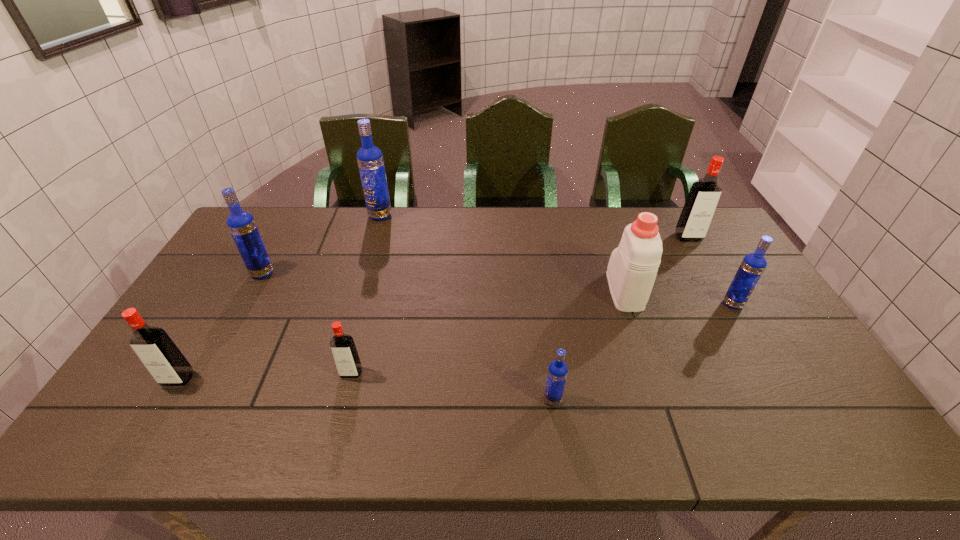
At what (x,y) coordinates should I click in order to perform the action: click on empty space that is in between the rightmost blue vodka and the tallest vodka. Please return your answer as a coordinate pair (x, y). Looking at the image, I should click on (557, 260).

Locate an element on the screen. This screenshot has height=540, width=960. vacant space that is in between the nearest vodka and the leftmost red vodka is located at coordinates [365, 389].

Locate an element on the screen. The width and height of the screenshot is (960, 540). empty space that is in between the sixth object from left to right and the fifth nearest vodka is located at coordinates (444, 282).

This screenshot has width=960, height=540. I want to click on free spot between the third farthest blue vodka and the tallest object, so click(557, 260).

Where is `free space between the sixth object from left to right and the second smallest red vodka`? free space between the sixth object from left to right and the second smallest red vodka is located at coordinates (401, 335).

Locate an element on the screen. The image size is (960, 540). empty location between the smallest red vodka and the farthest object is located at coordinates (366, 294).

Locate an element on the screen. vacant area that lies between the white detergent and the second smallest blue vodka is located at coordinates (679, 297).

Find the location of `vacant region between the detergent and the fourth nearest vodka`. vacant region between the detergent and the fourth nearest vodka is located at coordinates (679, 297).

Point out which object is positioned as the fourth nearest to the leftmost red vodka. Please provide its 2D coordinates. Your answer should be formatted as a tuple, i.e. [(x, y)], where the tuple contains the x and y coordinates of a point satisfying the conditions above.

[(557, 372)]

Locate an element on the screen. object that is the fourth closest one to the second farthest object is located at coordinates (370, 160).